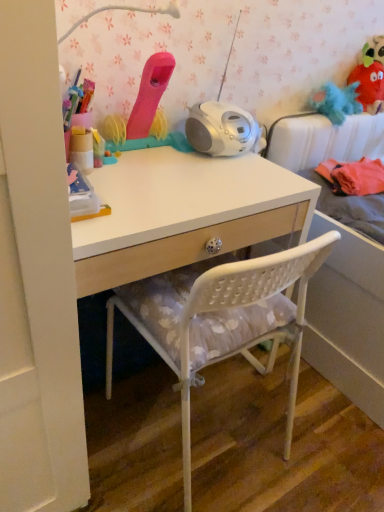
How much space does matte pink toy at upper center, arranged as the first toy when viewed from the front, occupy horizontally?

It is 5.77 inches.

Image resolution: width=384 pixels, height=512 pixels. What do you see at coordinates (370, 76) in the screenshot?
I see `fuzzy fabric plush at upper right, which ranks as the third toy in left-to-right order` at bounding box center [370, 76].

Measure the distance between white matte desk at center and camera.

They are 31.00 inches apart.

Describe the element at coordinates (220, 319) in the screenshot. This screenshot has width=384, height=512. I see `white plastic chair at center` at that location.

You are a GUI agent. You are given a task and a screenshot of the screen. Output one action in this format:
    pyautogui.click(x=<x>, y=<y>)
    Task: Click on the matte pink toy at upper center, the 1th toy when ordered from left to right
    
    Given the screenshot: What is the action you would take?
    pyautogui.click(x=146, y=112)

From the picture: Is blue fluffy toy at upper right, positioned as the 2th toy in right-to-left order, to the left of white matte desk at center from the viewer's perspective?

No.

Could you tell me if blue fluffy toy at upper right, the 2th toy in the back-to-front sequence, is facing white matte desk at center?

No, blue fluffy toy at upper right, the 2th toy in the back-to-front sequence, is not facing towards white matte desk at center.

Consider the image. Does blue fluffy toy at upper right, the 2th toy viewed from the front, have a smaller size compared to white matte desk at center?

Yes.

Does point (346, 96) appear closer or farther from the camera than point (206, 223)?

Point (346, 96).

Between white fabric bed at upper right and blue fluffy toy at upper right, which is the 2th toy in left-to-right order, which one appears on the right side from the viewer's perspective?

Positioned to the right is white fabric bed at upper right.

From the image's perspective, which is above, white fabric bed at upper right or blue fluffy toy at upper right, positioned as the 2th toy in right-to-left order?

blue fluffy toy at upper right, positioned as the 2th toy in right-to-left order.

Is white fabric bed at upper right wider than blue fluffy toy at upper right, the 2th toy in the back-to-front sequence?

Yes, white fabric bed at upper right is wider than blue fluffy toy at upper right, the 2th toy in the back-to-front sequence.

Is white fabric bed at upper right turned away from blue fluffy toy at upper right, the 2th toy viewed from the front?

No, blue fluffy toy at upper right, the 2th toy viewed from the front, is not at the back of white fabric bed at upper right.

Measure the distance between white fabric bed at upper right and white plastic chair at center.

A distance of 17.46 inches exists between white fabric bed at upper right and white plastic chair at center.

Is white fabric bed at upper right wider or thinner than white plastic chair at center?

In the image, white fabric bed at upper right appears to be wider than white plastic chair at center.

Does point (375, 262) appear closer or farther from the camera than point (206, 315)?

Point (375, 262).

Is white fabric bed at upper right far from white plastic chair at center?

No, white fabric bed at upper right is in close proximity to white plastic chair at center.

In the image, is white fabric bed at upper right positioned in front of or behind white matte desk at center?

Visually, white fabric bed at upper right is located behind white matte desk at center.

From a real-world perspective, is white fabric bed at upper right above or below white matte desk at center?

In terms of real-world spatial position, white fabric bed at upper right is above white matte desk at center.

Considering the relative sizes of white fabric bed at upper right and white matte desk at center in the image provided, is white fabric bed at upper right taller than white matte desk at center?

Correct, white fabric bed at upper right is much taller as white matte desk at center.

From the image's perspective, which one is positioned lower, white matte desk at center or matte pink toy at upper center, arranged as the first toy when viewed from the front?

white matte desk at center appears lower in the image.

Relative to matte pink toy at upper center, the 1th toy when ordered from left to right, is white matte desk at center in front or behind?

Clearly, white matte desk at center is in front of matte pink toy at upper center, the 1th toy when ordered from left to right.

Can you see white matte desk at center touching matte pink toy at upper center, placed as the third toy when sorted from right to left?

No, white matte desk at center is not beside matte pink toy at upper center, placed as the third toy when sorted from right to left.

From the image's perspective, relative to white plastic chair at center, is matte pink toy at upper center, the 1th toy when ordered from left to right, above or below?

From the image's perspective, matte pink toy at upper center, the 1th toy when ordered from left to right, appears above white plastic chair at center.

From a real-world perspective, which object rests below the other?

In real-world perspective, white plastic chair at center is lower.

Measure the distance between matte pink toy at upper center, placed as the third toy when sorted from right to left, and white plastic chair at center.

matte pink toy at upper center, placed as the third toy when sorted from right to left, is 54.36 centimeters away from white plastic chair at center.

From the image's perspective, count 1st toys upward from the white plastic chair at center and point to it. Please provide its 2D coordinates.

[(146, 112)]

Can you confirm if fuzzy fabric plush at upper right, arranged as the 1th toy when viewed from the back, is bigger than blue fluffy toy at upper right, which is the 2th toy in left-to-right order?

Yes.

Starting from the fuzzy fabric plush at upper right, which ranks as the third toy in left-to-right order, which toy is the 1st one to the left? Please provide its 2D coordinates.

[(335, 102)]

How many degrees apart are the facing directions of fuzzy fabric plush at upper right, marked as the third toy in a front-to-back arrangement, and blue fluffy toy at upper right, the 2th toy in the back-to-front sequence?

fuzzy fabric plush at upper right, marked as the third toy in a front-to-back arrangement, and blue fluffy toy at upper right, the 2th toy in the back-to-front sequence, are facing 5.29 degrees away from each other.

How much distance is there between fuzzy fabric plush at upper right, arranged as the 1th toy when viewed from the back, and blue fluffy toy at upper right, the 2th toy viewed from the front?

A distance of 3.89 inches exists between fuzzy fabric plush at upper right, arranged as the 1th toy when viewed from the back, and blue fluffy toy at upper right, the 2th toy viewed from the front.

I want to click on table that appears in front of the blue fluffy toy at upper right, the 2th toy in the back-to-front sequence, so click(x=175, y=224).

Locate an element on the screen. The image size is (384, 512). bed below the blue fluffy toy at upper right, the 2th toy viewed from the front (from the image's perspective) is located at coordinates (348, 317).

Considering their positions, is white matte desk at center positioned further to fuzzy fabric plush at upper right, acting as the first toy starting from the right, than blue fluffy toy at upper right, which is the 2th toy in left-to-right order?

white matte desk at center is positioned further to the anchor fuzzy fabric plush at upper right, acting as the first toy starting from the right.

Based on their spatial positions, is matte pink toy at upper center, arranged as the first toy when viewed from the front, or fuzzy fabric plush at upper right, acting as the first toy starting from the right, closer to blue fluffy toy at upper right, positioned as the 2th toy in right-to-left order?

fuzzy fabric plush at upper right, acting as the first toy starting from the right, lies closer to blue fluffy toy at upper right, positioned as the 2th toy in right-to-left order, than the other object.

Estimate the real-world distances between objects in this image. Which object is closer to fuzzy fabric plush at upper right, marked as the third toy in a front-to-back arrangement, white plastic chair at center or white fabric bed at upper right?

white fabric bed at upper right lies closer to fuzzy fabric plush at upper right, marked as the third toy in a front-to-back arrangement, than the other object.

From the image, which object appears to be farther from white fabric bed at upper right, matte pink toy at upper center, arranged as the first toy when viewed from the front, or white matte desk at center?

matte pink toy at upper center, arranged as the first toy when viewed from the front.

From the picture: Based on their spatial positions, is white fabric bed at upper right or fuzzy fabric plush at upper right, which ranks as the third toy in left-to-right order, closer to blue fluffy toy at upper right, the 2th toy in the back-to-front sequence?

Among the two, fuzzy fabric plush at upper right, which ranks as the third toy in left-to-right order, is located nearer to blue fluffy toy at upper right, the 2th toy in the back-to-front sequence.

Which object lies nearer to the anchor point white fabric bed at upper right, white plastic chair at center or blue fluffy toy at upper right, positioned as the 2th toy in right-to-left order?

The object closer to white fabric bed at upper right is white plastic chair at center.

From the image, which object appears to be nearer to matte pink toy at upper center, which is counted as the 3th toy, starting from the back, white plastic chair at center or fuzzy fabric plush at upper right, which ranks as the third toy in left-to-right order?

The object closer to matte pink toy at upper center, which is counted as the 3th toy, starting from the back, is white plastic chair at center.

Considering their positions, is matte pink toy at upper center, arranged as the first toy when viewed from the front, positioned closer to fuzzy fabric plush at upper right, acting as the first toy starting from the right, than white matte desk at center?

Among the two, matte pink toy at upper center, arranged as the first toy when viewed from the front, is located nearer to fuzzy fabric plush at upper right, acting as the first toy starting from the right.

Locate an element on the screen. The image size is (384, 512). bed between fuzzy fabric plush at upper right, arranged as the 1th toy when viewed from the back, and white plastic chair at center from top to bottom is located at coordinates (348, 317).

I want to click on table positioned between white plastic chair at center and blue fluffy toy at upper right, which is the 2th toy in left-to-right order, from near to far, so click(x=175, y=224).

Where is `toy between white matte desk at center and fuzzy fabric plush at upper right, which ranks as the third toy in left-to-right order, from left to right`? This screenshot has width=384, height=512. toy between white matte desk at center and fuzzy fabric plush at upper right, which ranks as the third toy in left-to-right order, from left to right is located at coordinates (335, 102).

Locate an element on the screen. table between matte pink toy at upper center, placed as the third toy when sorted from right to left, and blue fluffy toy at upper right, the 2th toy in the back-to-front sequence, from left to right is located at coordinates (175, 224).